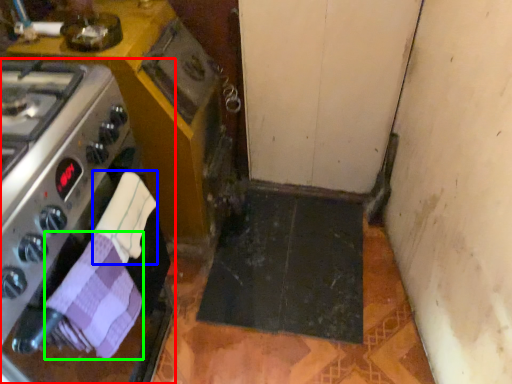
Question: Which is nearer to the kitchen appliance (highlighted by a red box)? hand towel (highlighted by a blue box) or hand towel (highlighted by a green box).

Choices:
 (A) hand towel
 (B) hand towel

Answer: (B)